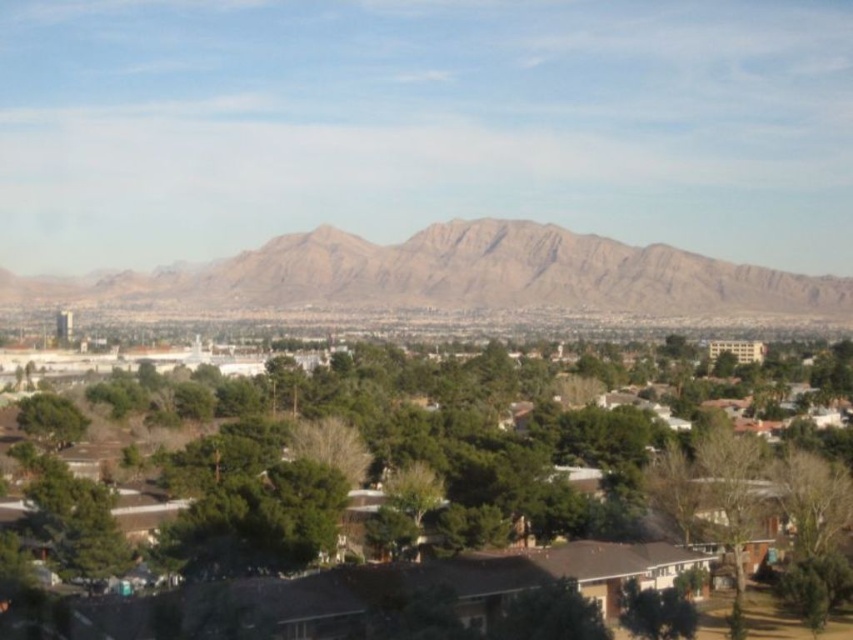
Question: Which point is closer to the camera?

Choices:
 (A) (38, 488)
 (B) (329, 259)

Answer: (A)

Question: Is green leafy tree at center wider than brown rocky mountain range at center?

Choices:
 (A) no
 (B) yes

Answer: (A)

Question: Which point is closer to the camera?

Choices:
 (A) brown rocky mountain range at center
 (B) green leafy tree at center

Answer: (B)

Question: Is green leafy tree at center below brown rocky mountain range at center?

Choices:
 (A) yes
 (B) no

Answer: (A)

Question: Does green leafy tree at center appear over brown rocky mountain range at center?

Choices:
 (A) no
 (B) yes

Answer: (A)

Question: Which point appears closest to the camera in this image?

Choices:
 (A) (77, 612)
 (B) (833, 284)

Answer: (A)